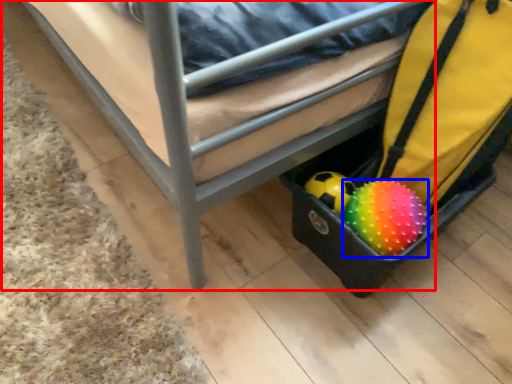
Question: Which of the following is the closest to the observer, furniture (highlighted by a red box) or ball (highlighted by a blue box)?

Choices:
 (A) furniture
 (B) ball

Answer: (A)